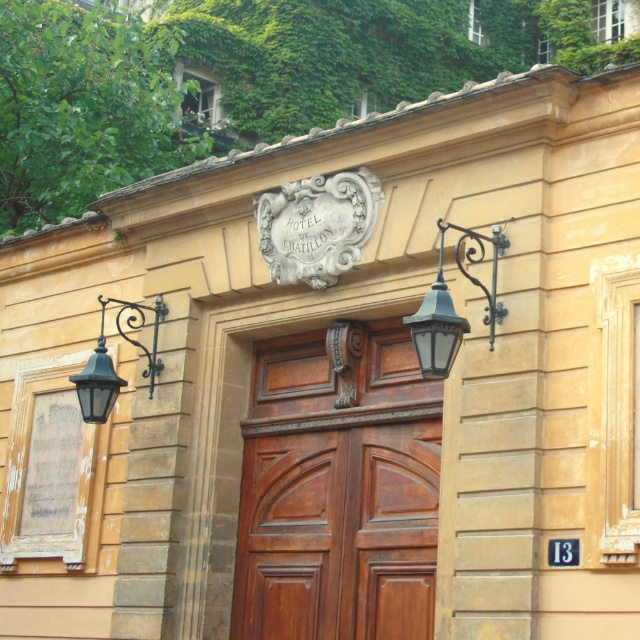
Question: Among these points, which one is nearest to the camera?

Choices:
 (A) (355, 326)
 (B) (444, 365)

Answer: (B)

Question: Which of the following is the farthest from the observer?

Choices:
 (A) (426, 312)
 (B) (432, 394)
 (C) (138, 321)

Answer: (C)

Question: Based on their relative distances, which object is farther from the polished wood door at center?

Choices:
 (A) matte black lantern at center right
 (B) matte black lantern at left

Answer: (B)

Question: Can you confirm if polished wood door at center is thinner than matte black lantern at left?

Choices:
 (A) no
 (B) yes

Answer: (A)

Question: Is polished wood door at center thinner than matte black lantern at left?

Choices:
 (A) no
 (B) yes

Answer: (A)

Question: Can you confirm if matte black lantern at center right is positioned to the right of matte black lantern at left?

Choices:
 (A) yes
 (B) no

Answer: (A)